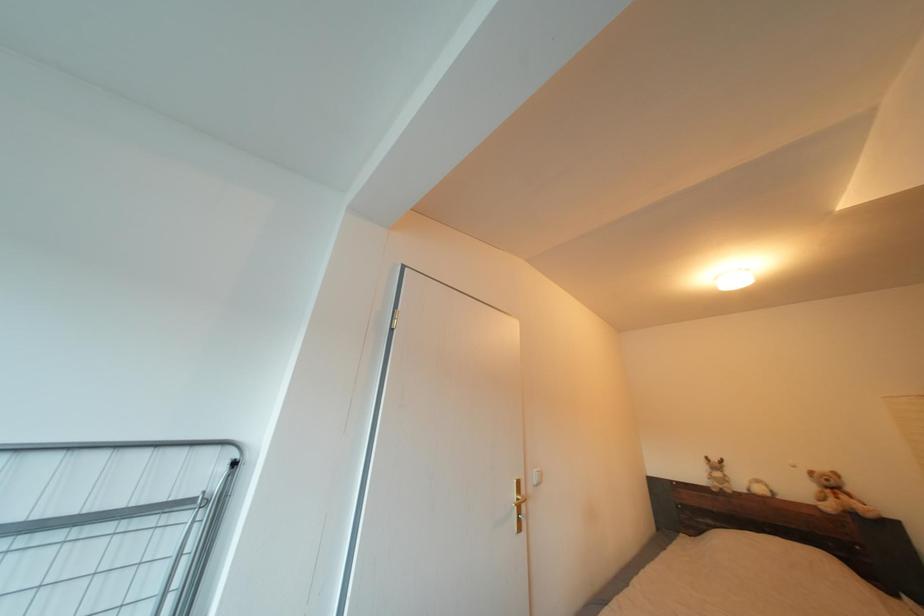
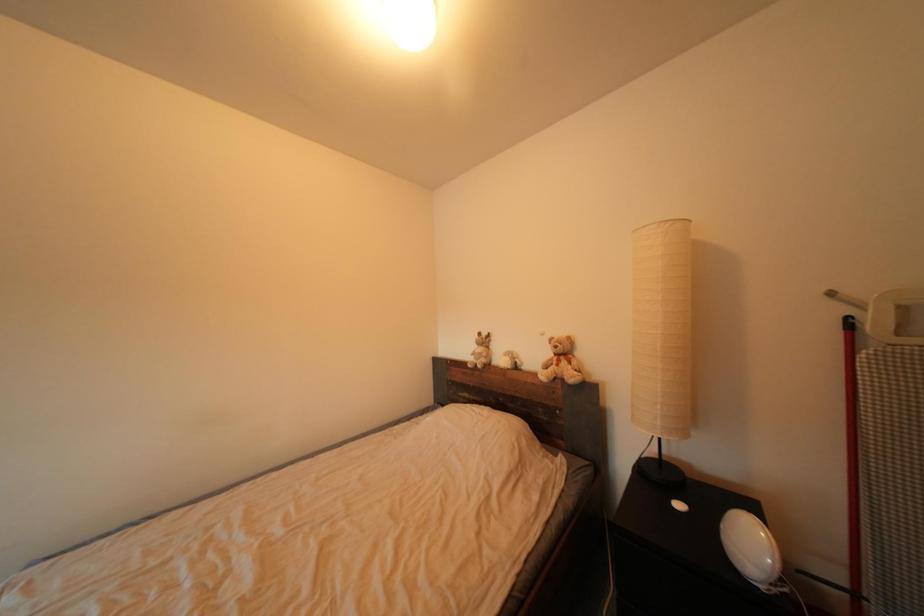
Question: Which direction would the cameraman need to move to produce the second image? Reply with the corresponding letter.

Choices:
 (A) Left
 (B) Right
 (C) Forward
 (D) Backward

Answer: (B)